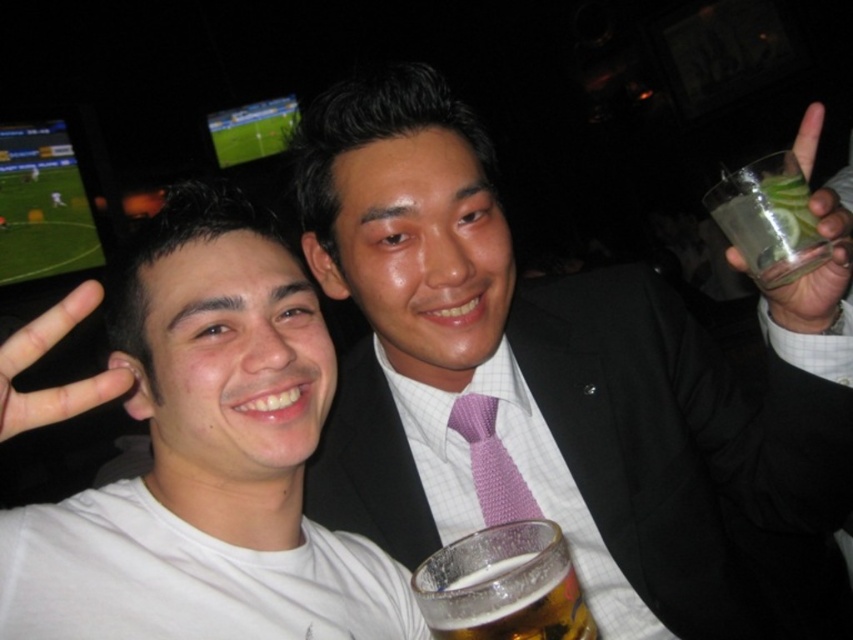
You are a bartender who needs to reach the translucent glass beer at center for a customer. The customer is standing 20 inches away from you. Can you hand them the beer without moving closer?

The translucent glass beer at center is 18.82 inches from viewer, which is less than the 20 inches distance between you and the customer. Therefore, you can hand them the beer without moving closer.